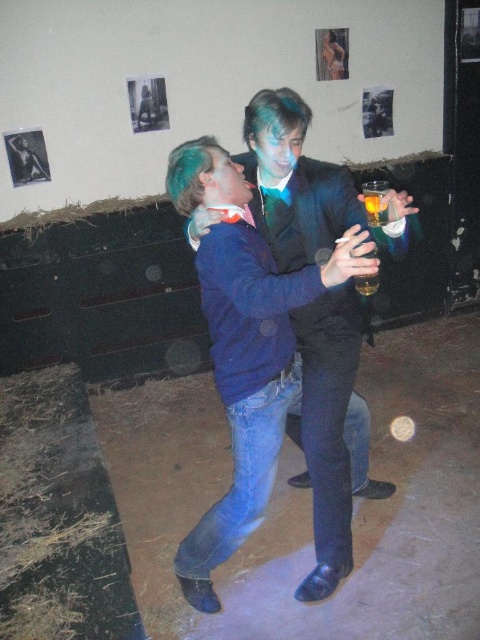
Based on the photo, can you confirm if blue denim jacket at center is bigger than translucent glass at upper right?

Correct, blue denim jacket at center is larger in size than translucent glass at upper right.

Between blue denim jacket at center and translucent glass at upper right, which one is positioned higher?

Positioned higher is translucent glass at upper right.

This screenshot has height=640, width=480. Describe the element at coordinates (330, 429) in the screenshot. I see `blue denim jacket at center` at that location.

This screenshot has width=480, height=640. I want to click on blue denim jacket at center, so click(330, 429).